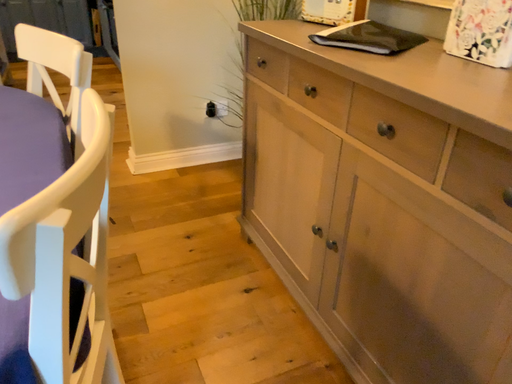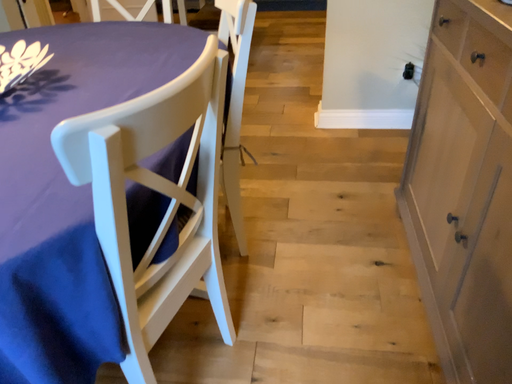
Question: How did the camera likely rotate when shooting the video?

Choices:
 (A) rotated left
 (B) rotated right

Answer: (A)